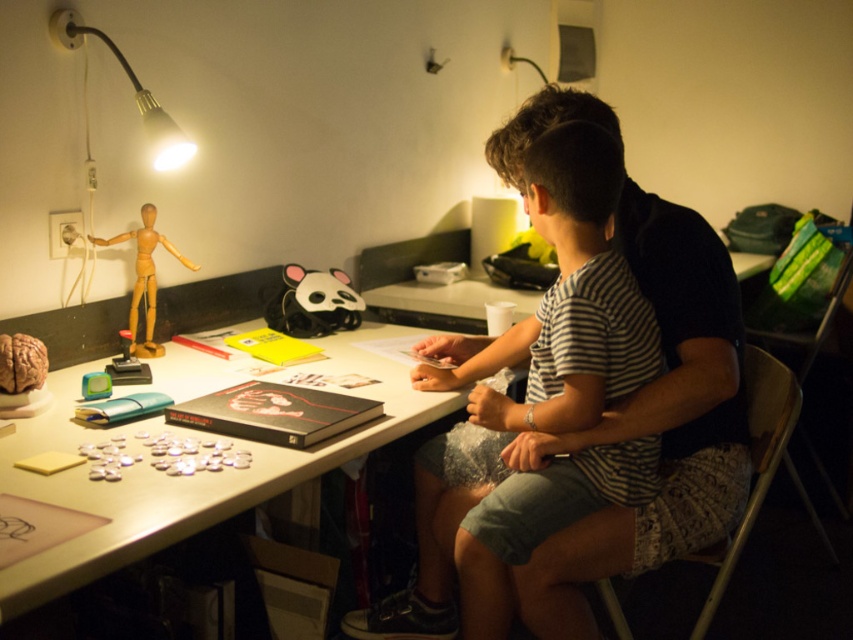
Consider the image. Is white glossy table at center positioned at the back of wooden mannequin at left?

No, it is in front of wooden mannequin at left.

Which is above, white glossy table at center or wooden mannequin at left?

wooden mannequin at left is higher up.

Does point (415, 333) come behind point (144, 342)?

Yes, point (415, 333) is behind point (144, 342).

At what (x,y) coordinates should I click in order to perform the action: click on white glossy table at center. Please return your answer as a coordinate pair (x, y). This screenshot has width=853, height=640. Looking at the image, I should click on (196, 474).

Is point (485, 449) positioned after point (62, 36)?

No, (485, 449) is in front of (62, 36).

Does striped cotton shirt at center have a lesser height compared to matte black lamp at upper left?

Incorrect, striped cotton shirt at center's height does not fall short of matte black lamp at upper left's.

The width and height of the screenshot is (853, 640). Identify the location of striped cotton shirt at center. (534, 406).

Identify the location of striped cotton shirt at center. This screenshot has width=853, height=640. (534, 406).

Is striped cotton shirt at center below wooden mannequin at left?

Correct, striped cotton shirt at center is located below wooden mannequin at left.

Is the position of striped cotton shirt at center more distant than that of wooden mannequin at left?

No.

Is point (476, 449) positioned in front of point (161, 236)?

Yes, it is.

At what (x,y) coordinates should I click in order to perform the action: click on striped cotton shirt at center. Please return your answer as a coordinate pair (x, y). Looking at the image, I should click on (534, 406).